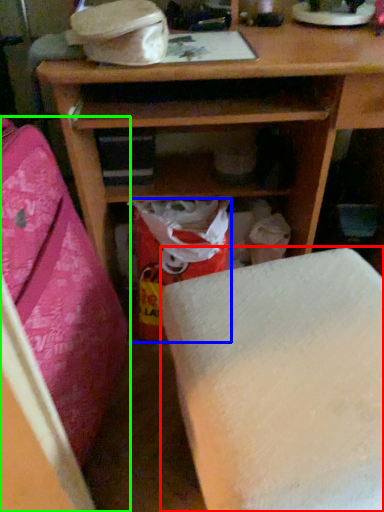
Question: Based on their relative distances, which object is nearer to furniture (highlighted by a red box)? Choose from shopping bag (highlighted by a blue box) and furniture (highlighted by a green box).

Choices:
 (A) shopping bag
 (B) furniture

Answer: (B)